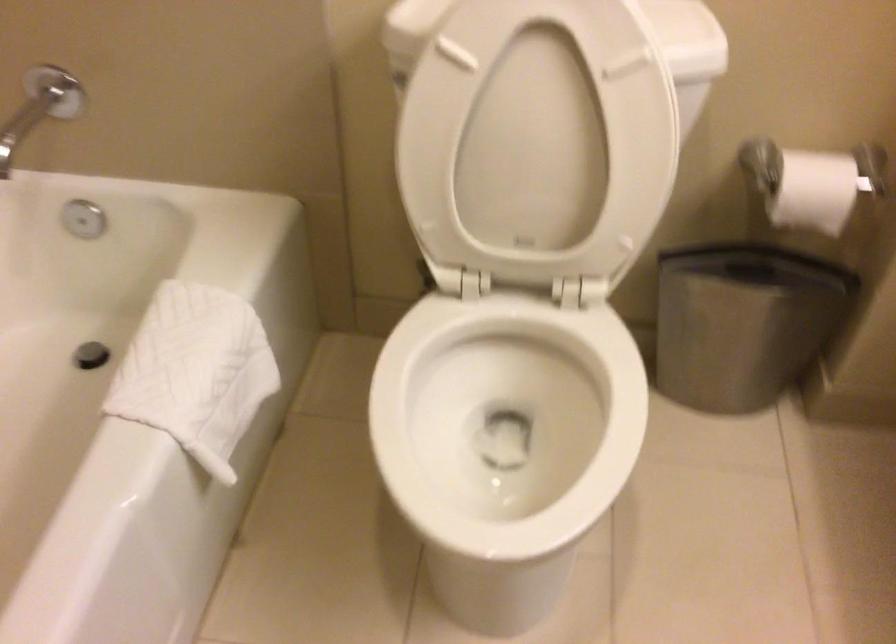
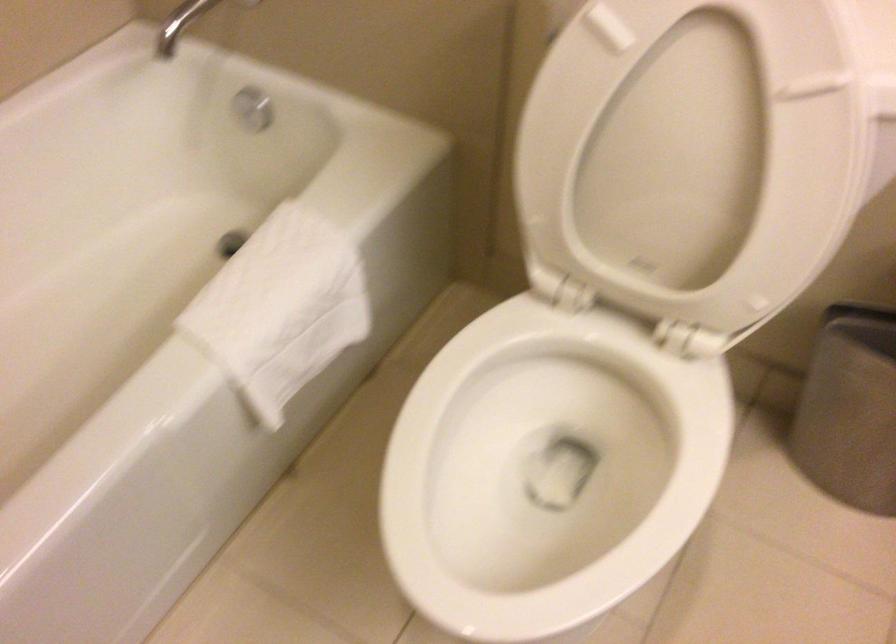
Where in the second image is the point corresponding to the point at 705,323 from the first image?

(858, 402)